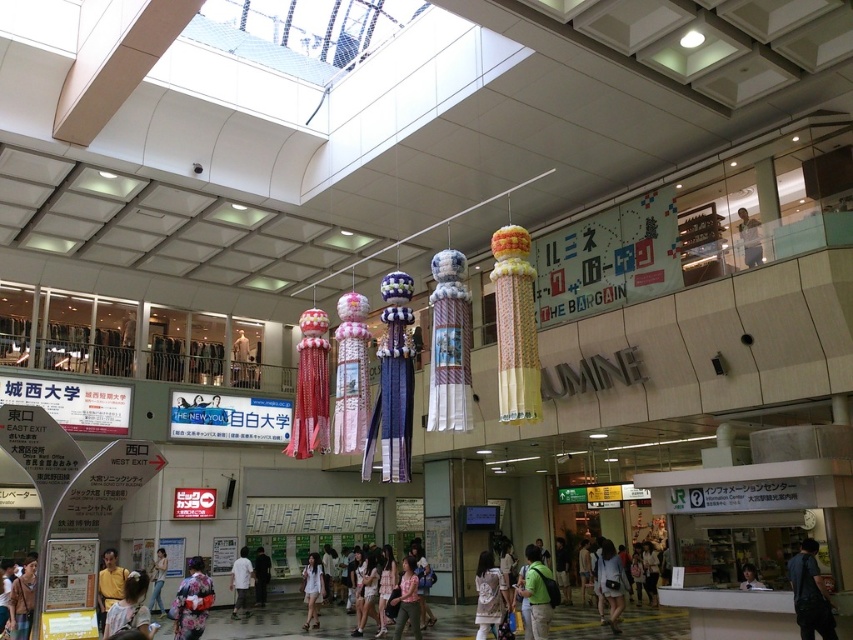
Which of these two, dark blue jeans at lower right or light brown leather jacket at lower left, stands shorter?

With less height is light brown leather jacket at lower left.

Does dark blue jeans at lower right appear on the right side of light brown leather jacket at lower left?

Yes, dark blue jeans at lower right is to the right of light brown leather jacket at lower left.

Is point (828, 634) positioned before point (22, 573)?

Yes, it is.

Identify the location of dark blue jeans at lower right. Image resolution: width=853 pixels, height=640 pixels. (810, 593).

Can you confirm if pink fabric dress at center is wider than kimono-clad person at center?

In fact, pink fabric dress at center might be narrower than kimono-clad person at center.

Is point (398, 595) in front of point (234, 566)?

Yes, it is.

Image resolution: width=853 pixels, height=640 pixels. In order to click on pink fabric dress at center in this screenshot , I will do `click(405, 600)`.

From the picture: Between matte white shirt at lower center and white cotton dress at center, which one has more height?

With more height is matte white shirt at lower center.

Does matte white shirt at lower center appear under white cotton dress at center?

Actually, matte white shirt at lower center is above white cotton dress at center.

Where is `matte white shirt at lower center`? Image resolution: width=853 pixels, height=640 pixels. matte white shirt at lower center is located at coordinates (610, 580).